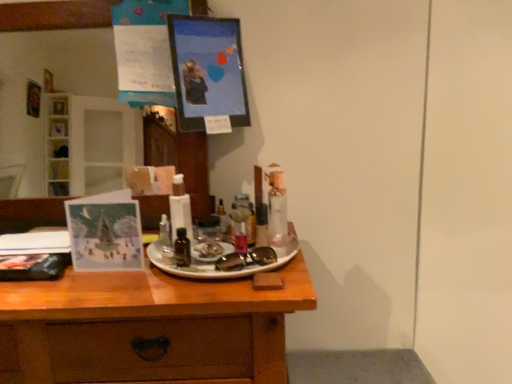
Image resolution: width=512 pixels, height=384 pixels. Find the location of `free space to the left of black glass bottle at center, which is counted as the first toiletry, starting from the front`. free space to the left of black glass bottle at center, which is counted as the first toiletry, starting from the front is located at coordinates (118, 266).